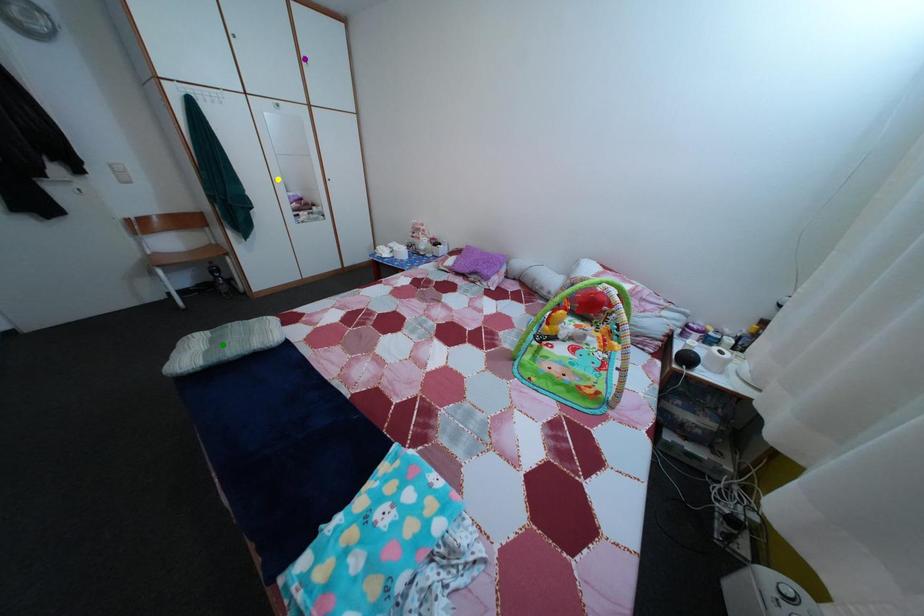
Order these from nearest to farthest:
1. green point
2. purple point
3. yellow point

green point < purple point < yellow point